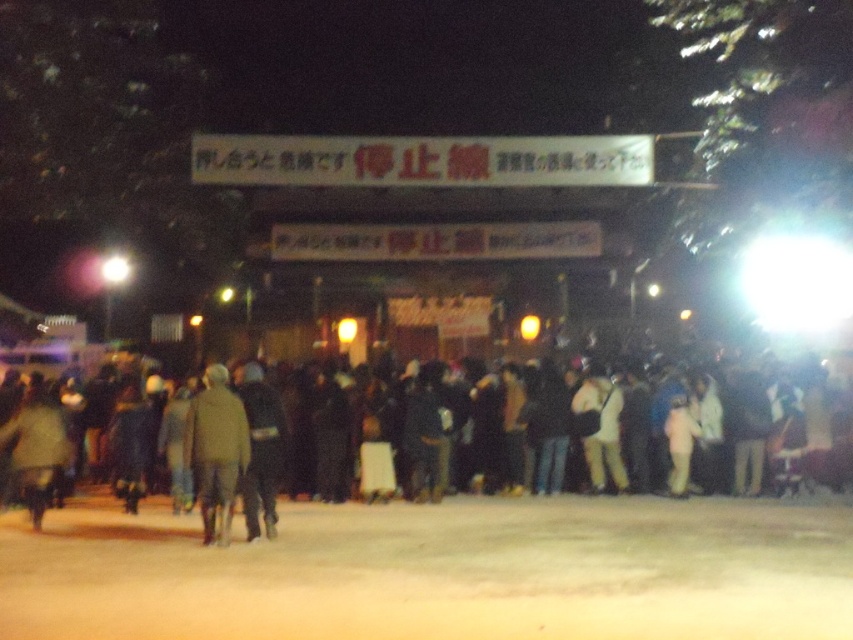
Is point (70, 424) more distant than point (216, 448)?

Yes, point (70, 424) is farther from viewer.

Find the location of a particular element. Image resolution: width=853 pixels, height=640 pixels. black fabric crowd at center is located at coordinates (546, 428).

Between point (387, 497) and point (207, 477), which one is positioned in front?

Positioned in front is point (207, 477).

I want to click on black fabric crowd at center, so click(x=546, y=428).